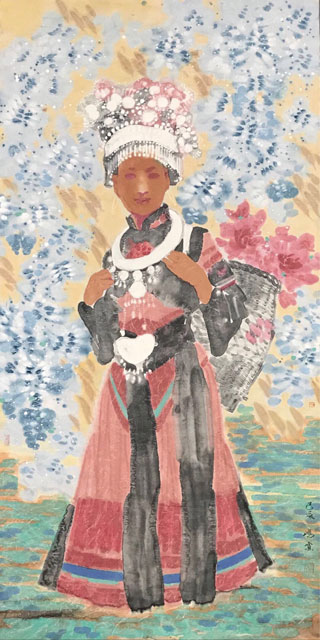
Where is `top left and right corners of the painting`? top left and right corners of the painting is located at coordinates 14,8, 303,9.